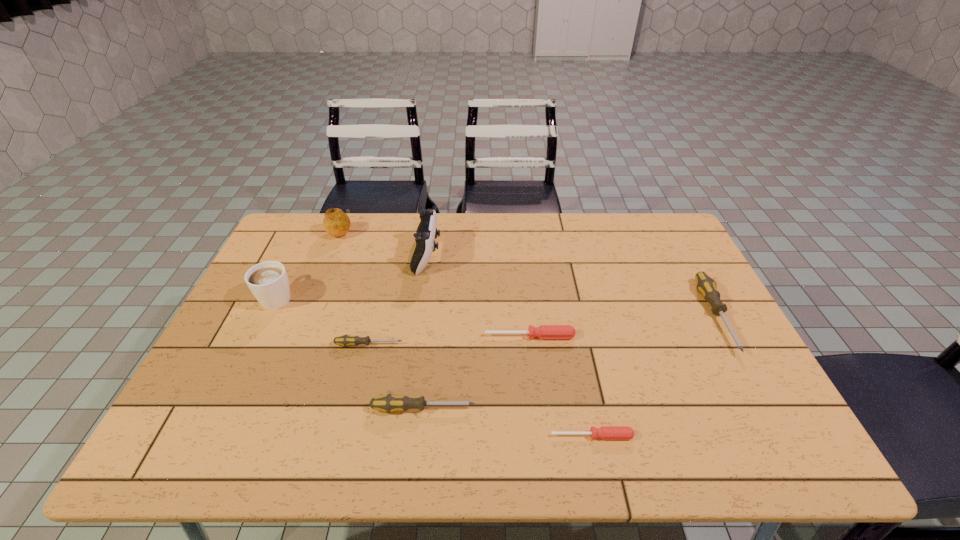
Where is `free point that satisfies the following two spatial constraints: 1. on the front-facing side of the control; 2. on the left side of the farther red screwdriver`? The width and height of the screenshot is (960, 540). free point that satisfies the following two spatial constraints: 1. on the front-facing side of the control; 2. on the left side of the farther red screwdriver is located at coordinates (416, 336).

Find the location of a particular element. free point that satisfies the following two spatial constraints: 1. at the tip of the nearer red screwdriver; 2. on the right side of the smallest gray screwdriver is located at coordinates (348, 436).

The height and width of the screenshot is (540, 960). Find the location of `vacant position in the image that satisfies the following two spatial constraints: 1. on the front-facing side of the control; 2. on the back side of the bigger red screwdriver`. vacant position in the image that satisfies the following two spatial constraints: 1. on the front-facing side of the control; 2. on the back side of the bigger red screwdriver is located at coordinates point(416,336).

The width and height of the screenshot is (960, 540). In order to click on free space that satisfies the following two spatial constraints: 1. on the back side of the smaller red screwdriver; 2. at the tip of the smallest gray screwdriver in this screenshot , I will do `click(573, 345)`.

The height and width of the screenshot is (540, 960). I want to click on vacant space that satisfies the following two spatial constraints: 1. at the tip of the fourth tallest object; 2. at the tip of the second nearest screwdriver, so click(x=766, y=408).

Identify the location of vacant position in the image that satisfies the following two spatial constraints: 1. with the handle on the side of the second object from left to right; 2. on the right side of the leftmost object. (310, 231).

Identify the location of free space that satisfies the following two spatial constraints: 1. on the front-facing side of the control; 2. on the left side of the farther red screwdriver. (416, 336).